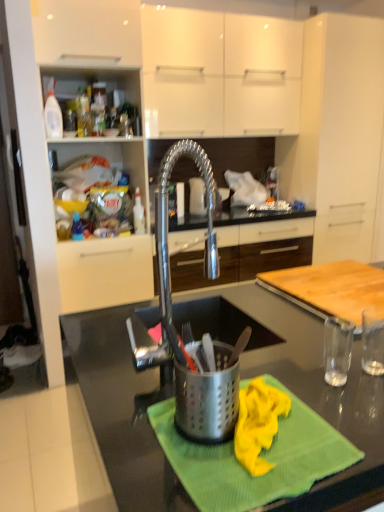
Question: Considering the positions of translucent plastic bottle at upper left and stainless steel utensil holder at center in the image, is translucent plastic bottle at upper left taller or shorter than stainless steel utensil holder at center?

Choices:
 (A) short
 (B) tall

Answer: (B)

Question: In terms of width, does translucent plastic bottle at upper left look wider or thinner when compared to stainless steel utensil holder at center?

Choices:
 (A) wide
 (B) thin

Answer: (B)

Question: Estimate the real-world distances between objects in this image. Which object is farther from the white matte cabinet at upper right, the second cabinetry positioned from the top?

Choices:
 (A) stainless steel utensil holder at center
 (B) green textured cloth at center
 (C) polished stainless steel faucet at center
 (D) satin nickel faucet at center, positioned as the 3th cabinetry in top-to-bottom order
 (E) metallic gray countertop at center

Answer: (B)

Question: Which is nearer to the white plastic bottle at upper left?

Choices:
 (A) polished stainless steel faucet at center
 (B) white matte cabinet at upper right, the second cabinetry positioned from the top
 (C) green textured cloth at center
 (D) stainless steel utensil holder at center
 (E) satin nickel faucet at center, the 1th cabinetry ordered from the bottom

Answer: (E)